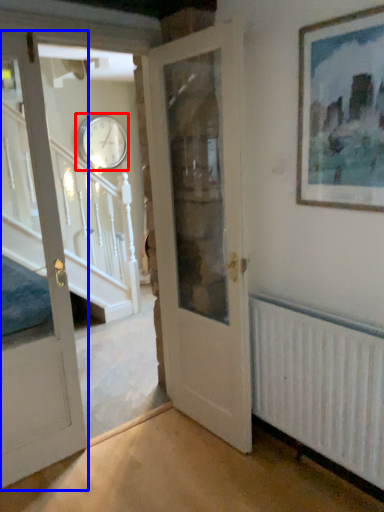
Question: Which object is further to the camera taking this photo, clock (highlighted by a red box) or door (highlighted by a blue box)?

Choices:
 (A) clock
 (B) door

Answer: (A)